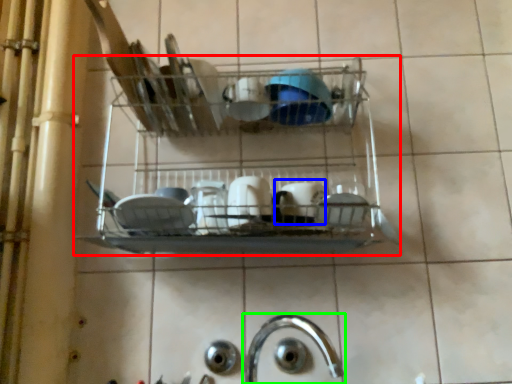
Question: Which object is positioned closest to shelf (highlighted by a red box)? Select from tableware (highlighted by a blue box) and tap (highlighted by a green box).

Choices:
 (A) tableware
 (B) tap

Answer: (A)